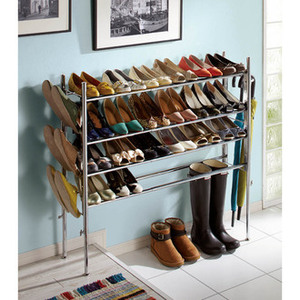
Locate an element on the screen. The width and height of the screenshot is (300, 300). shoes hanging on side of shelf is located at coordinates (70, 107), (49, 104), (48, 141), (63, 150), (52, 170), (62, 185).